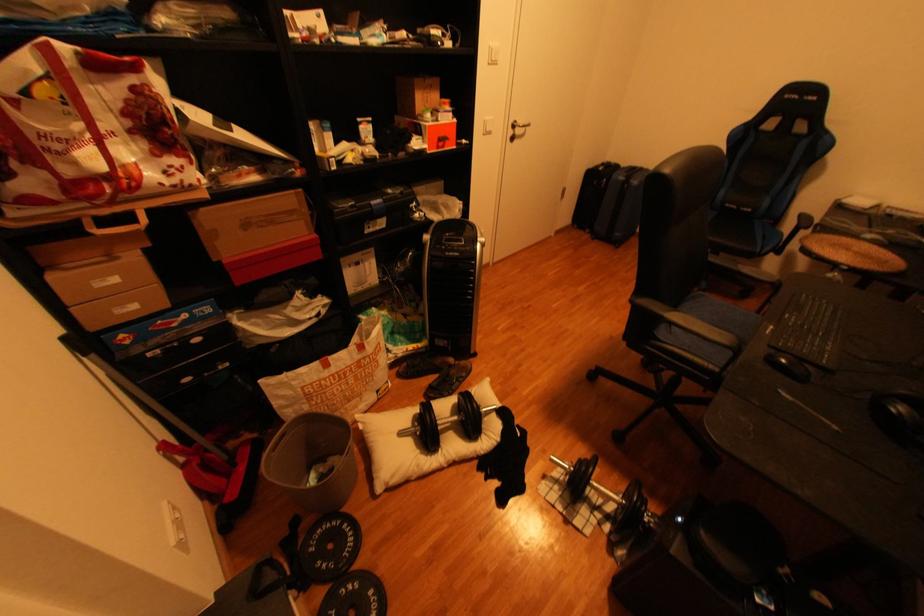
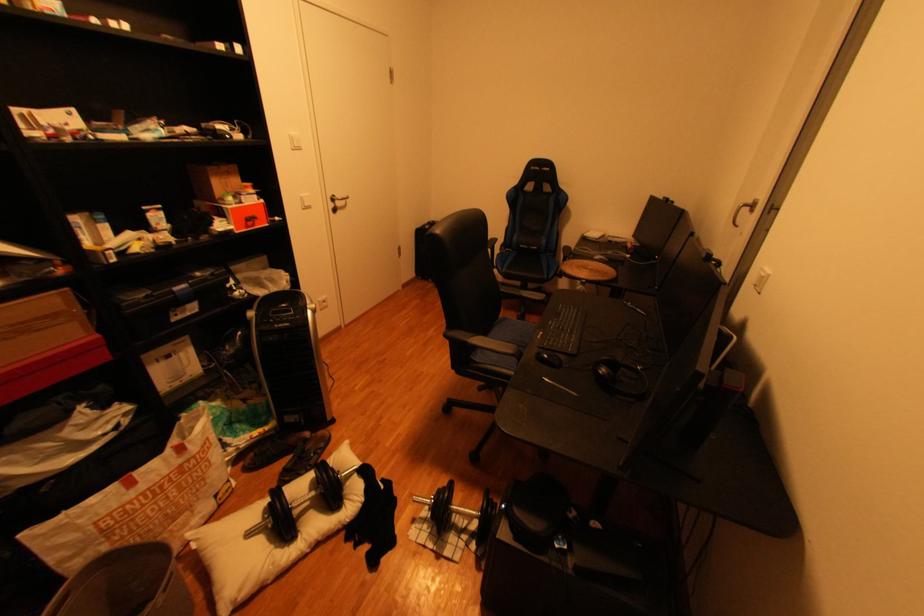
The point at (x=434, y=95) is marked in the first image. Where is the corresponding point in the second image?

(235, 182)